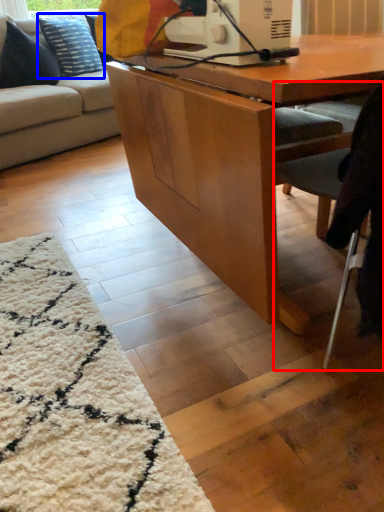
Question: Which point is closer to the camera, chair (highlighted by a red box) or pillow (highlighted by a blue box)?

Choices:
 (A) chair
 (B) pillow

Answer: (A)